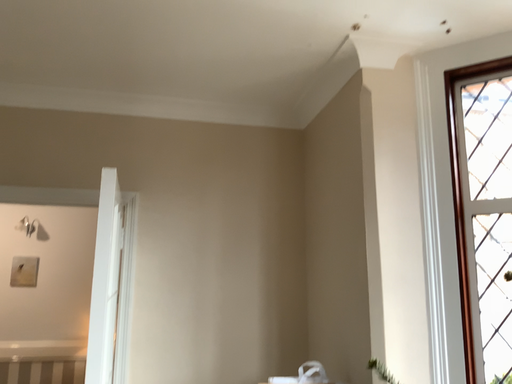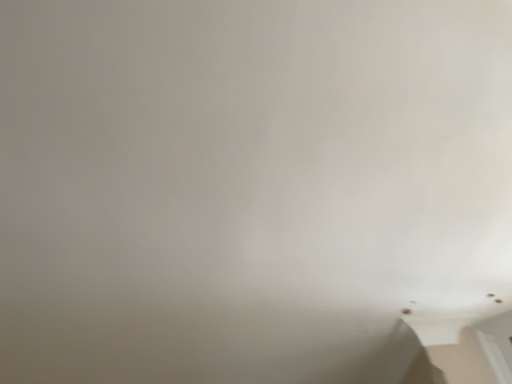
Question: Which way did the camera rotate in the video?

Choices:
 (A) rotated right
 (B) rotated left

Answer: (B)